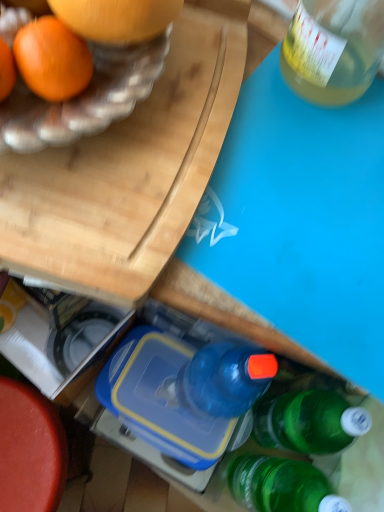
Question: Is smooth red table at lower left looking in the opposite direction of blue plastic lunch box at center?

Choices:
 (A) no
 (B) yes

Answer: (A)

Question: From the image's perspective, is smooth red table at lower left located above blue plastic lunch box at center?

Choices:
 (A) yes
 (B) no

Answer: (B)

Question: Could you tell me if smooth red table at lower left is turned towards blue plastic lunch box at center?

Choices:
 (A) yes
 (B) no

Answer: (B)

Question: Is smooth red table at lower left bigger than blue plastic lunch box at center?

Choices:
 (A) yes
 (B) no

Answer: (A)

Question: Is the position of smooth red table at lower left more distant than that of blue plastic lunch box at center?

Choices:
 (A) yes
 (B) no

Answer: (A)

Question: From the image's perspective, is smooth red table at lower left located beneath blue plastic lunch box at center?

Choices:
 (A) yes
 (B) no

Answer: (A)

Question: Is blue plastic lunch box at center thinner than smooth red table at lower left?

Choices:
 (A) yes
 (B) no

Answer: (A)

Question: From a real-world perspective, is blue plastic lunch box at center over smooth red table at lower left?

Choices:
 (A) no
 (B) yes

Answer: (B)

Question: Is blue plastic lunch box at center at the right side of smooth red table at lower left?

Choices:
 (A) no
 (B) yes

Answer: (B)

Question: Is blue plastic lunch box at center aimed at smooth red table at lower left?

Choices:
 (A) yes
 (B) no

Answer: (B)

Question: From the image's perspective, is blue plastic lunch box at center located beneath smooth red table at lower left?

Choices:
 (A) no
 (B) yes

Answer: (A)

Question: Does blue plastic lunch box at center have a smaller size compared to smooth red table at lower left?

Choices:
 (A) no
 (B) yes

Answer: (B)

Question: Could you tell me if blue plastic lunch box at center is facing wooden cutting board at upper left?

Choices:
 (A) no
 (B) yes

Answer: (A)